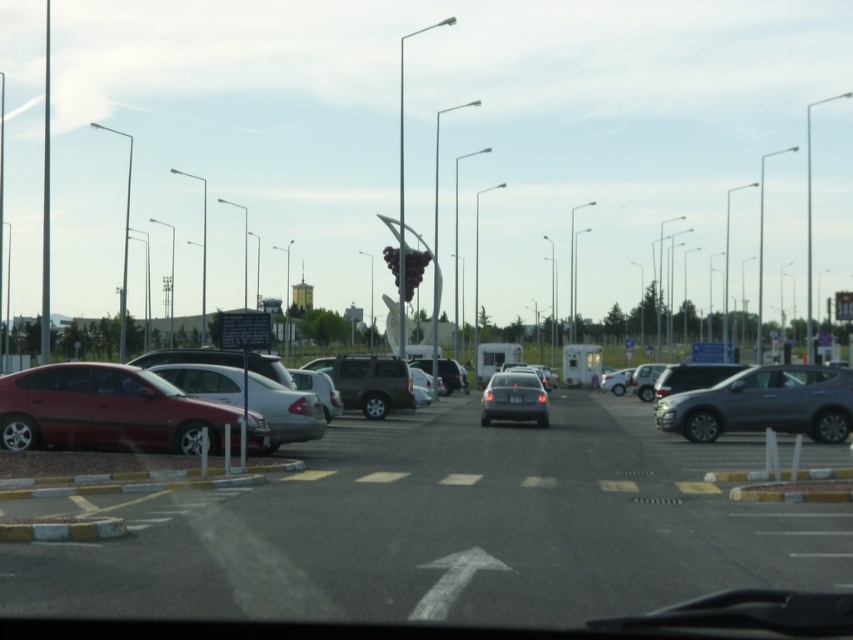
Question: Is metallic gray car at center positioned before matte gray suv at center-right?

Choices:
 (A) yes
 (B) no

Answer: (A)

Question: Which is farther from the metallic gray car at center?

Choices:
 (A) matte gray suv at center-right
 (B) matte red sedan at left
 (C) satin black sedan at center
 (D) silver metallic sedan at center-left

Answer: (C)

Question: Does matte red sedan at left appear over satin black sedan at center?

Choices:
 (A) yes
 (B) no

Answer: (A)

Question: Which point is closer to the camera?

Choices:
 (A) matte gray suv at center-right
 (B) satin black sedan at center

Answer: (A)

Question: Does metallic gray car at center have a lesser width compared to matte gray suv at center-right?

Choices:
 (A) no
 (B) yes

Answer: (A)

Question: Which point is closer to the camera?

Choices:
 (A) (173, 394)
 (B) (325, 422)

Answer: (A)